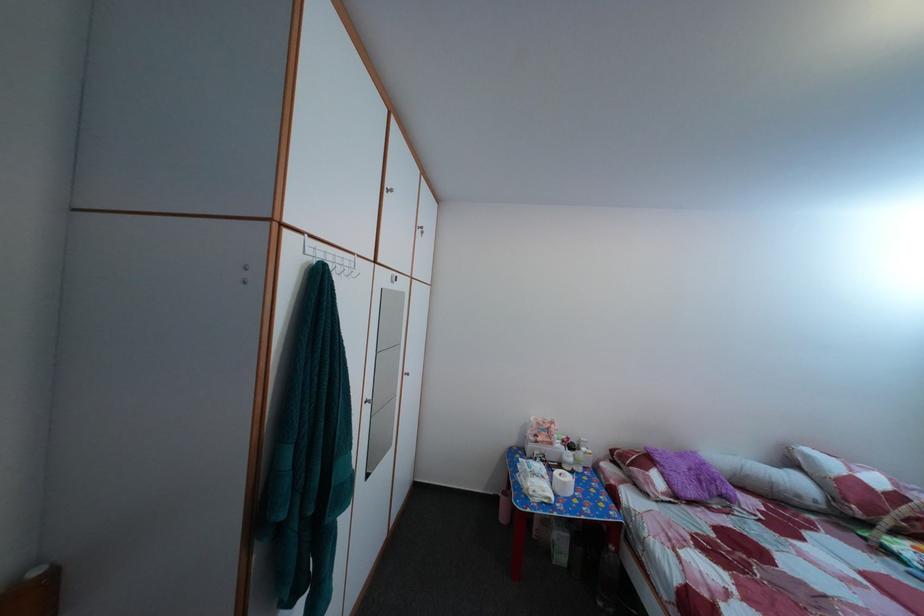
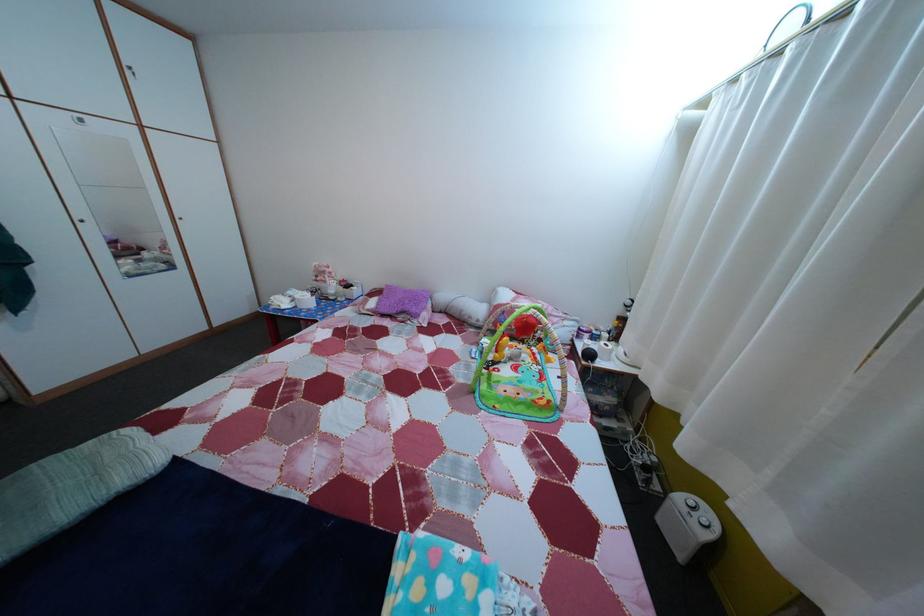
Question: The images are taken continuously from a first-person perspective. In which direction are you moving?

Choices:
 (A) Left
 (B) Right
 (C) Forward
 (D) Backward

Answer: (B)